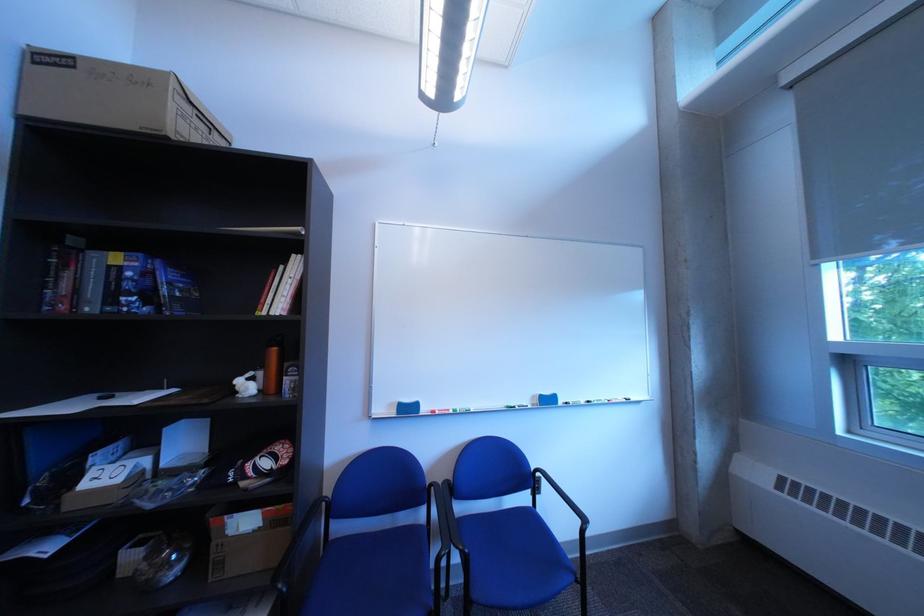
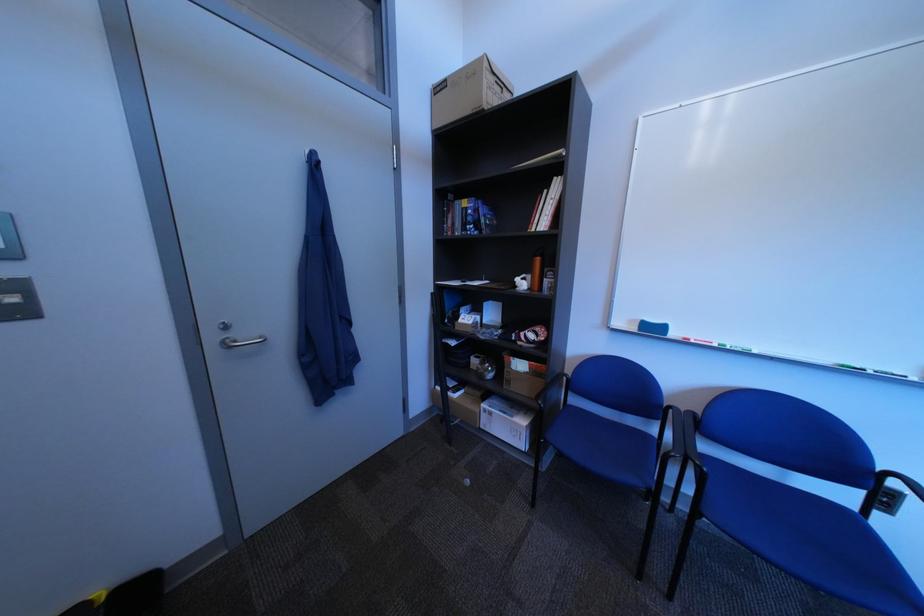
The point at (447, 492) is marked in the first image. Where is the corresponding point in the second image?

(687, 413)